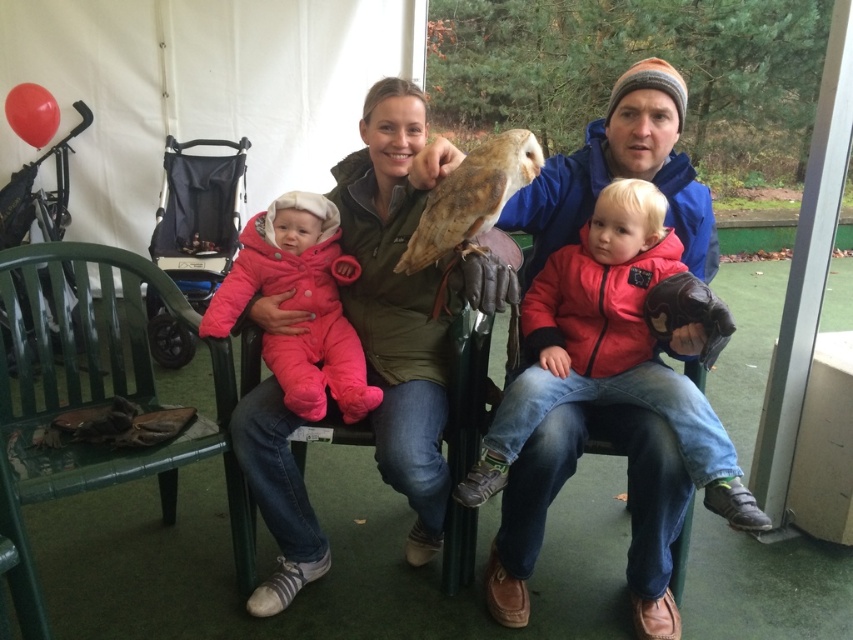
What are the coordinates of the blue fleece jacket at center?

The coordinates of the blue fleece jacket at center are at point (627, 506).

You are standing at the origin point of the coordinate system in the image. The blue fleece jacket at center is located at point (627, 506). If you want to move towards the blue fleece jacket at center, in which direction should you move?

The point (627, 506) is where the blue fleece jacket at center is located. Since you are at the origin, you should move towards the positive x and positive y direction to reach the blue fleece jacket at center.

You are a photographer trying to capture a photo of the blue fleece jacket at center and the pink fleece snowsuit at center. Which one should you focus on first if you want to ensure both are in focus?

The blue fleece jacket at center is much taller than the pink fleece snowsuit at center, so focusing on the taller object first would help ensure both are in focus.